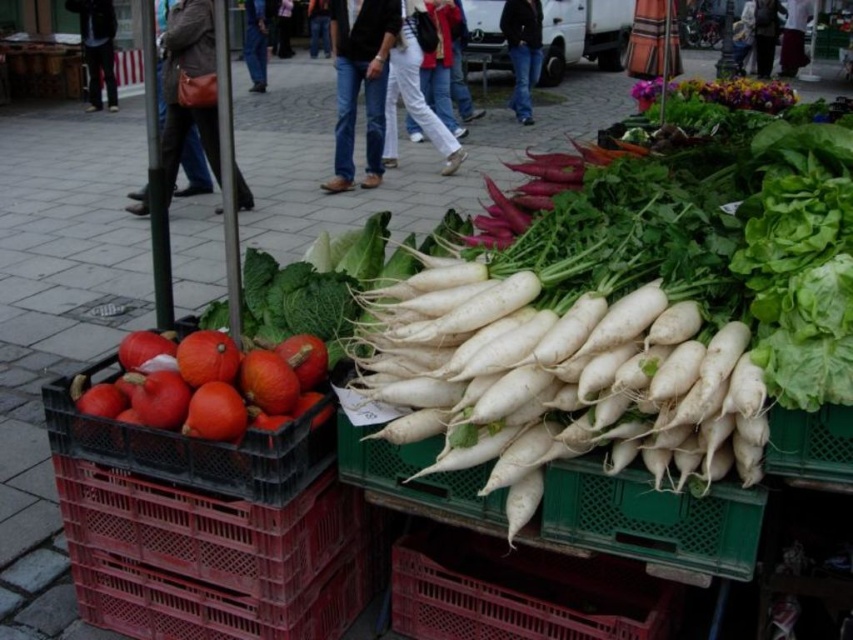
Is point (549, 608) closer to viewer compared to point (288, 340)?

Yes, it is.

Is matte plastic basket at lower center taller than orange matte pumpkin at left?

Indeed, matte plastic basket at lower center has a greater height compared to orange matte pumpkin at left.

Who is more distant from viewer, (590, 596) or (259, 365)?

Point (590, 596)

The image size is (853, 640). I want to click on matte plastic basket at lower center, so click(x=519, y=592).

Which is above, white smooth radish at center or orange matte pumpkin at left?

Positioned higher is white smooth radish at center.

Find the location of a particular element. The width and height of the screenshot is (853, 640). white smooth radish at center is located at coordinates (637, 307).

Is white smooth radish at center in front of matte plastic basket at lower center?

Yes, white smooth radish at center is in front of matte plastic basket at lower center.

Is white smooth radish at center thinner than matte plastic basket at lower center?

No, white smooth radish at center is not thinner than matte plastic basket at lower center.

Find the location of a particular element. white smooth radish at center is located at coordinates (637, 307).